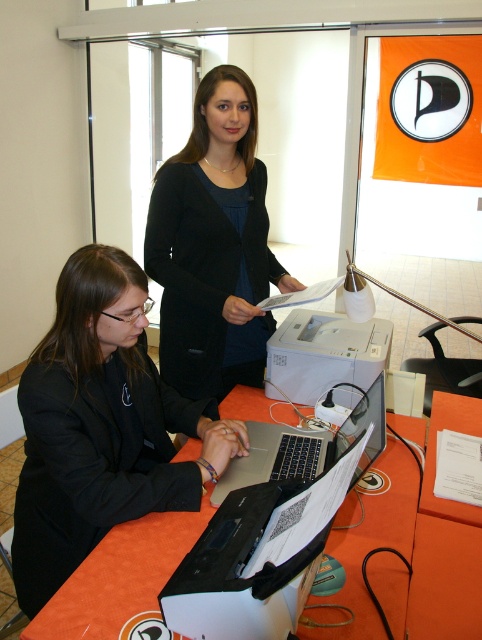
Question: Is black matte laptop at lower left thinner than orange fabric table at lower center?

Choices:
 (A) no
 (B) yes

Answer: (B)

Question: Which point is farther to the camera?

Choices:
 (A) black matte laptop at lower left
 (B) silver metallic laptop at center

Answer: (A)

Question: Based on their relative distances, which object is nearer to the black matte laptop at lower left?

Choices:
 (A) black matte blazer at upper center
 (B) silver metallic laptop at center
 (C) orange fabric table at lower center

Answer: (B)

Question: Is black matte laptop at lower left below black matte blazer at upper center?

Choices:
 (A) yes
 (B) no

Answer: (A)

Question: Is the position of black matte laptop at lower left more distant than that of black matte blazer at upper center?

Choices:
 (A) no
 (B) yes

Answer: (A)

Question: Which point is farther from the camera taking this photo?

Choices:
 (A) (298, 474)
 (B) (174, 380)

Answer: (B)